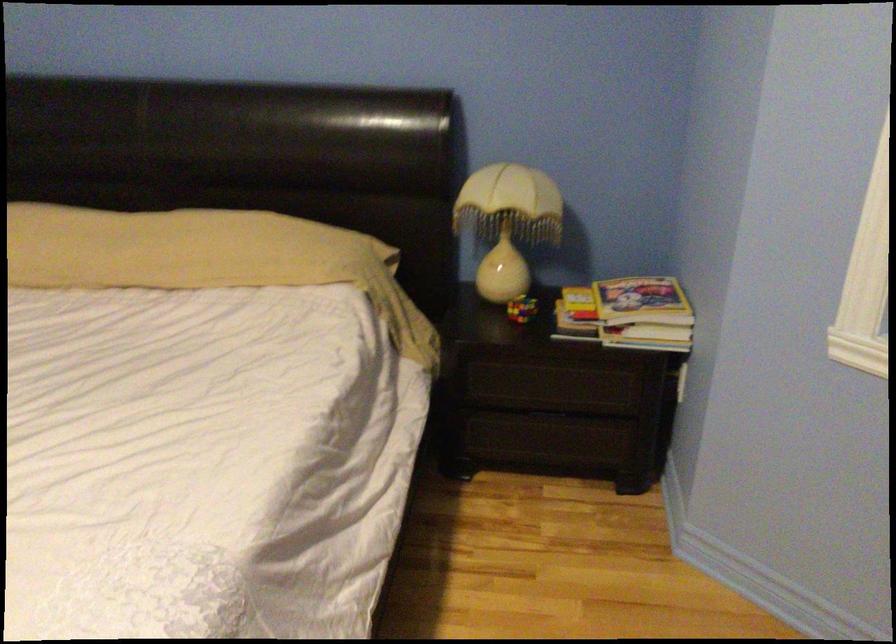
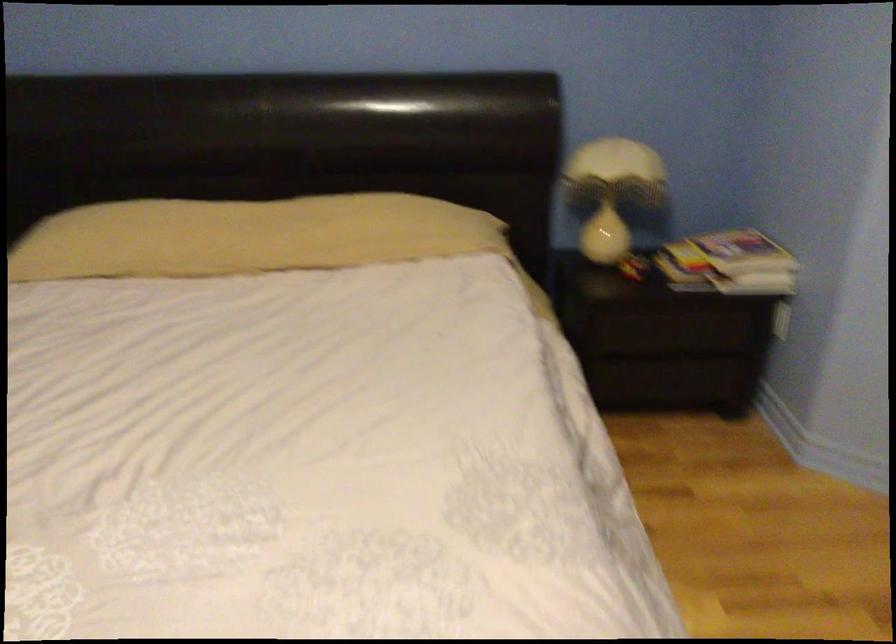
In the second image, find the point that corresponds to [107,249] in the first image.

(247, 236)